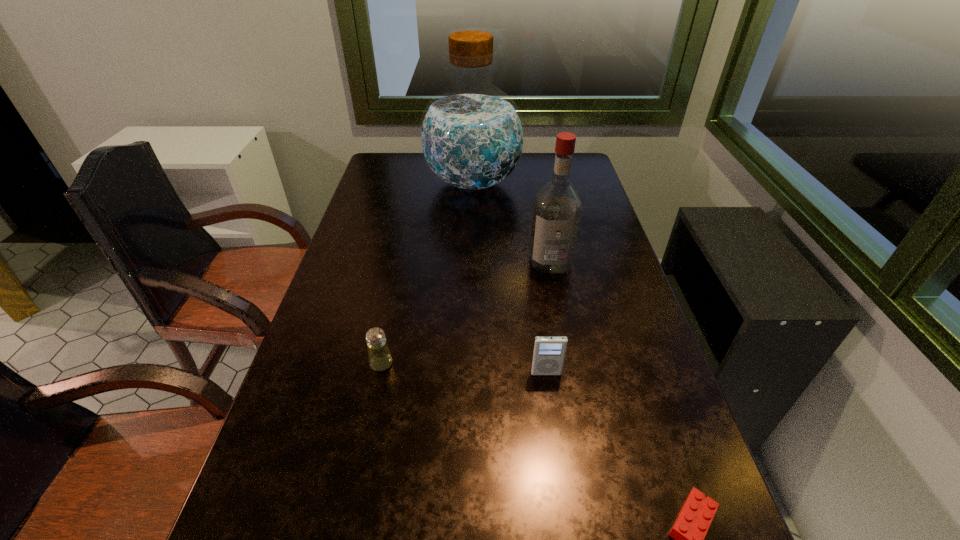
You are a GUI agent. You are given a task and a screenshot of the screen. Output one action in this format:
    pyautogui.click(x=<x>, y=<y>)
    Task: Click on the object positioned at the far edge
    Image resolution: width=960 pixels, height=540 pixels.
    Given the screenshot: What is the action you would take?
    pyautogui.click(x=471, y=135)

This screenshot has height=540, width=960. Find the location of `object that is positioned at the left edge`. object that is positioned at the left edge is located at coordinates (380, 359).

The image size is (960, 540). Find the location of `object located at the right edge`. object located at the right edge is located at coordinates (557, 210).

Find the location of a particular element. vacant space at the far edge is located at coordinates (525, 168).

This screenshot has width=960, height=540. What are the coordinates of `vacant position at the left edge of the desktop` in the screenshot? It's located at (354, 233).

Identify the location of vacant region at the right edge of the desktop. Image resolution: width=960 pixels, height=540 pixels. (575, 282).

In order to click on vacant space at the far left corner of the desktop in this screenshot , I will do `click(416, 166)`.

You are a GUI agent. You are given a task and a screenshot of the screen. Output one action in this format:
    pyautogui.click(x=<x>, y=<y>)
    Task: Click on the vacant region between the saltshaker and the liquor
    The width and height of the screenshot is (960, 540).
    Given the screenshot: What is the action you would take?
    pyautogui.click(x=466, y=313)

Image resolution: width=960 pixels, height=540 pixels. Identify the location of empty location between the water jug and the saltshaker. (427, 273).

This screenshot has height=540, width=960. In order to click on vacant space that's between the iPod and the water jug in this screenshot , I will do `click(510, 278)`.